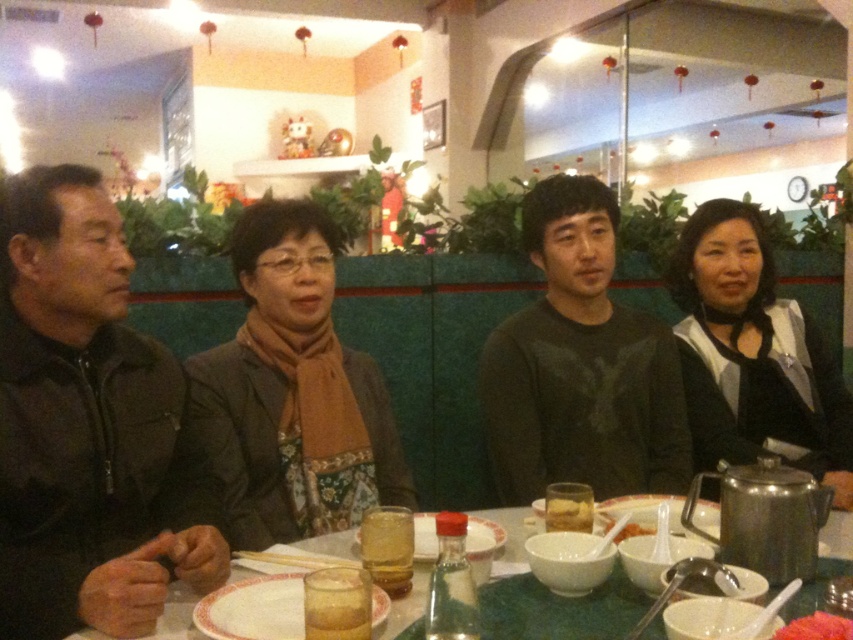
Question: Estimate the real-world distances between objects in this image. Which object is farther from the yellow matte tofu at center?

Choices:
 (A) brown fabric scarf at center
 (B) dark gray sweater at center
 (C) green marble table at center

Answer: (B)

Question: Can you confirm if dark brown leather jacket at left is positioned above yellow matte tofu at center?

Choices:
 (A) no
 (B) yes

Answer: (B)

Question: Which point is closer to the camera?

Choices:
 (A) dark brown leather jacket at left
 (B) dark gray sweater at center
 (C) yellow matte tofu at center

Answer: (A)

Question: Among these points, which one is nearest to the camera?

Choices:
 (A) (590, 520)
 (B) (613, 538)
 (C) (73, 422)

Answer: (B)

Question: Is dark brown leather jacket at left smaller than green marble table at center?

Choices:
 (A) no
 (B) yes

Answer: (A)

Question: From the image, what is the correct spatial relationship of dark gray sweater at center in relation to black matte jacket at right?

Choices:
 (A) above
 (B) below

Answer: (A)